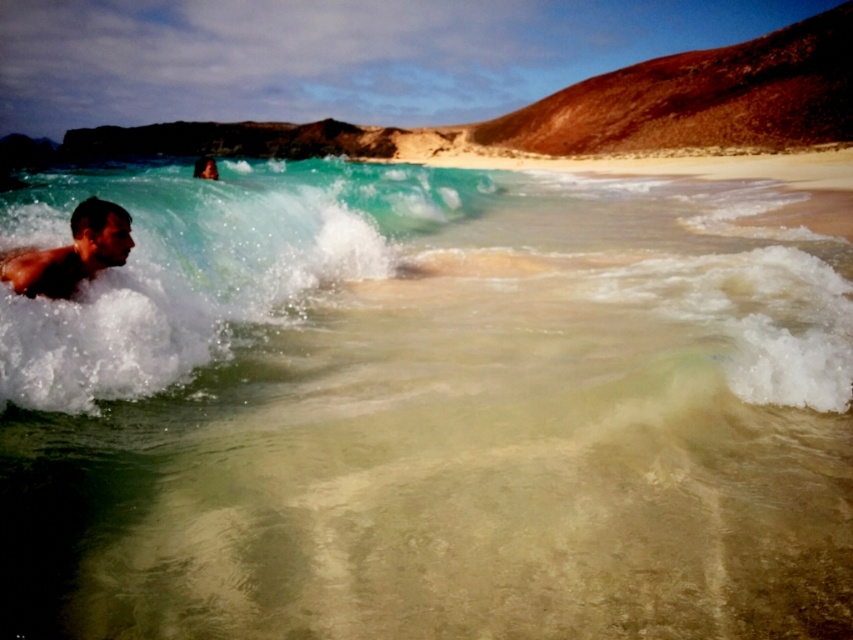
Does smooth skin man at left have a greater height compared to smooth skin surfer at upper left?

Incorrect, smooth skin man at left's height is not larger of smooth skin surfer at upper left's.

Between smooth skin man at left and smooth skin surfer at upper left, which one has more height?

Standing taller between the two is smooth skin surfer at upper left.

Locate an element on the screen. smooth skin man at left is located at coordinates (71, 252).

Image resolution: width=853 pixels, height=640 pixels. I want to click on smooth skin man at left, so click(71, 252).

Who is shorter, translucent white water at left or smooth skin surfer at upper left?

smooth skin surfer at upper left

Is translucent white water at left smaller than smooth skin surfer at upper left?

Actually, translucent white water at left might be larger than smooth skin surfer at upper left.

Which is in front, point (334, 209) or point (207, 163)?

Point (334, 209) is more forward.

Find the location of `translucent white water at left`. translucent white water at left is located at coordinates (202, 266).

Can you confirm if translucent white water at left is taller than smooth skin man at left?

Yes.

Is point (26, 316) closer to camera compared to point (108, 216)?

Yes, point (26, 316) is in front of point (108, 216).

Locate an element on the screen. The image size is (853, 640). translucent white water at left is located at coordinates (202, 266).